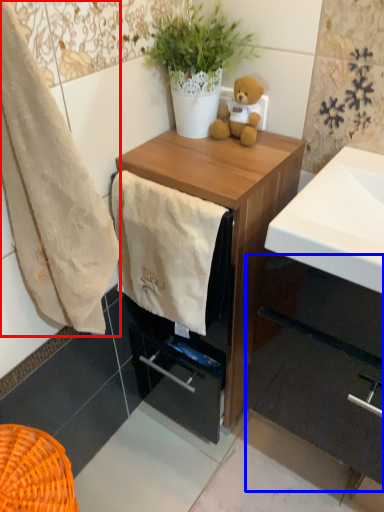
Question: Which of the following is the closest to the observer, towel/napkin (highlighted by a red box) or cabinetry (highlighted by a blue box)?

Choices:
 (A) towel/napkin
 (B) cabinetry

Answer: (A)